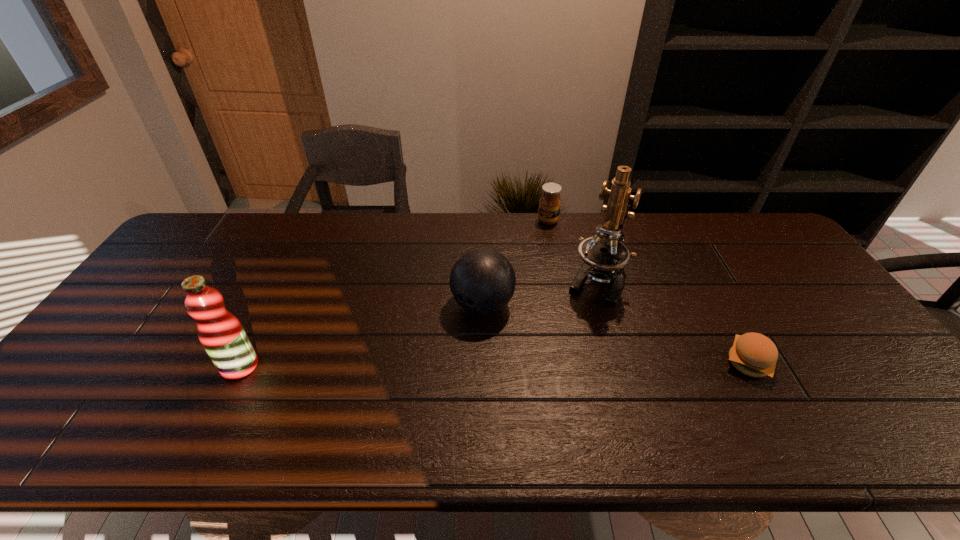
I want to click on free point between the honey and the fourth shortest object, so click(x=394, y=293).

Locate an element on the screen. free spot between the bowling ball and the microscope is located at coordinates (539, 293).

Locate an element on the screen. vacant area that lies between the tallest object and the rightmost object is located at coordinates (672, 322).

The height and width of the screenshot is (540, 960). In order to click on free area in between the third tallest object and the fruit juice in this screenshot , I will do `click(361, 335)`.

Find the location of a particular element. Image resolution: width=960 pixels, height=540 pixels. empty space between the third tallest object and the honey is located at coordinates (516, 263).

In order to click on empty space between the fourth object from right to left and the leftmost object in this screenshot , I will do `click(361, 335)`.

The height and width of the screenshot is (540, 960). Identify the location of unoccupied position between the tallest object and the third tallest object. (539, 293).

Identify the location of empty location between the second shortest object and the fourth object from right to left. (516, 263).

This screenshot has height=540, width=960. I want to click on vacant point located between the farthest object and the shortest object, so pyautogui.click(x=648, y=292).

The height and width of the screenshot is (540, 960). What are the coordinates of `object that is the nearest to the second tallest object` in the screenshot? It's located at (482, 281).